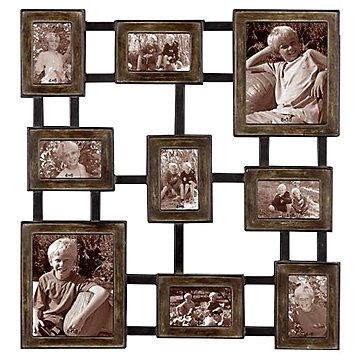
Image resolution: width=360 pixels, height=360 pixels. I want to click on frames, so click(x=329, y=345), click(x=235, y=331), click(x=118, y=338), click(x=108, y=169), click(x=75, y=87), click(x=120, y=76), click(x=158, y=141), click(x=250, y=127), click(x=262, y=172).